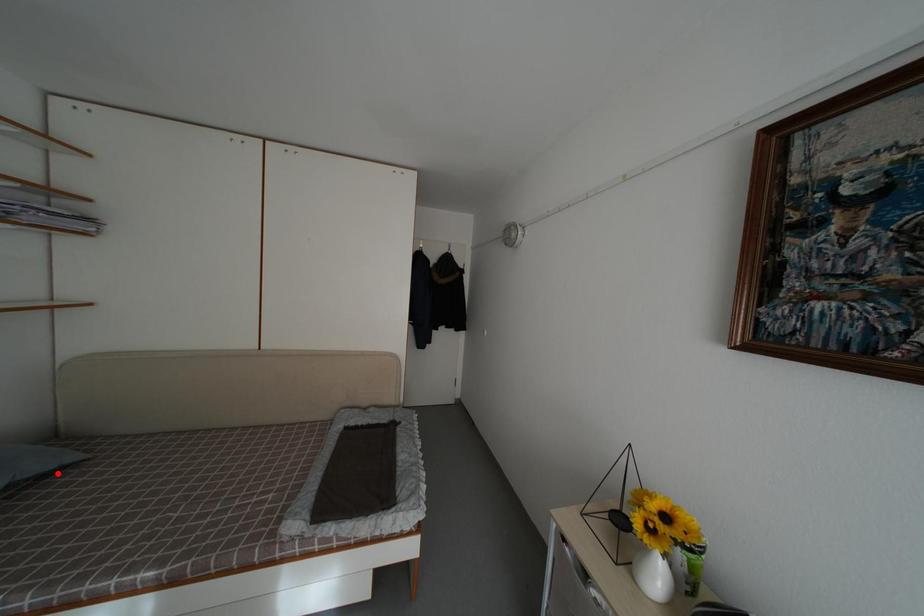
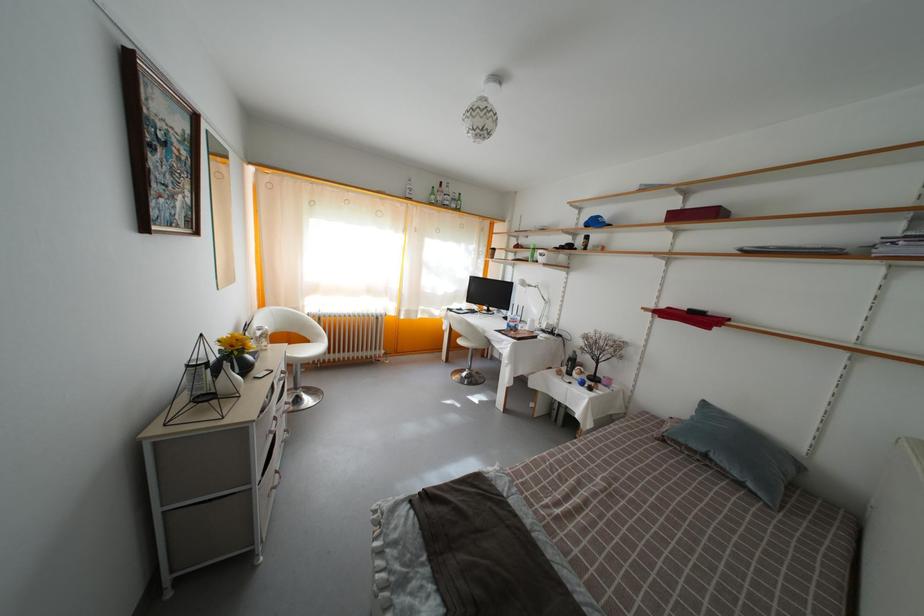
Question: I am providing you with two images of the same scene from different viewpoints. A red point is marked on the first image. Can you still see the location of the red point in image 2?

Choices:
 (A) Yes
 (B) No

Answer: (A)